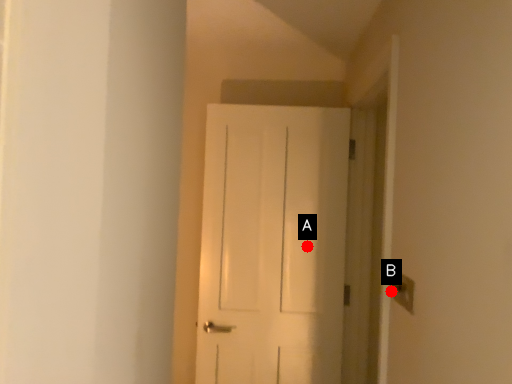
Question: Two points are circled on the image, labeled by A and B beside each circle. Which point is closer to the camera taking this photo?

Choices:
 (A) A is closer
 (B) B is closer

Answer: (B)